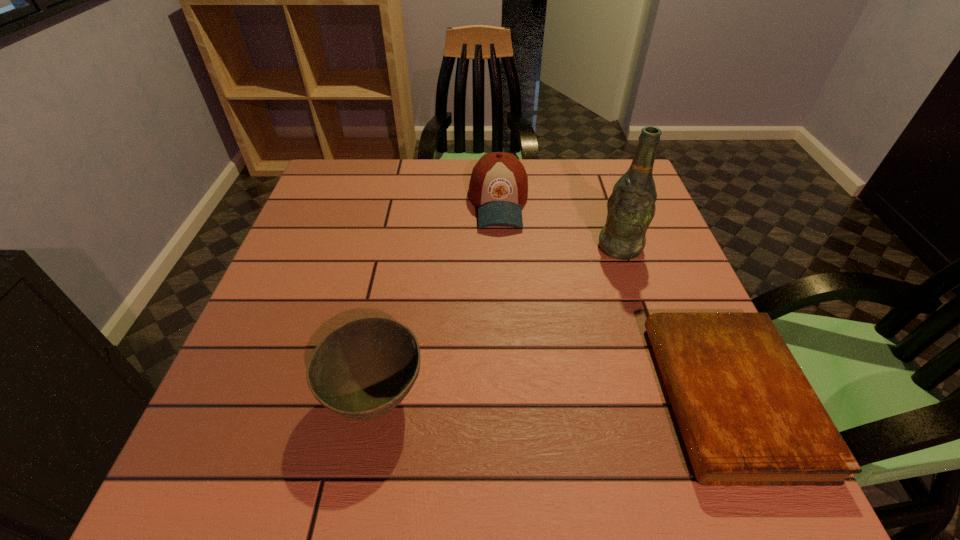
At what (x,y) coordinates should I click in order to perform the action: click on the leftmost object. Please return your answer as a coordinate pair (x, y). The width and height of the screenshot is (960, 540). Looking at the image, I should click on 363,369.

You are a GUI agent. You are given a task and a screenshot of the screen. Output one action in this format:
    pyautogui.click(x=<x>, y=<y>)
    Task: Click on the Bible
    
    Given the screenshot: What is the action you would take?
    pyautogui.click(x=748, y=416)

Locate an element on the screen. the tallest object is located at coordinates (631, 207).

I want to click on the third object from right to left, so click(x=498, y=185).

Locate an element on the screen. This screenshot has height=540, width=960. free space located 0.090m on the left of the bowl is located at coordinates (274, 397).

Identify the location of vacant space located on the spine side of the shortest object. (449, 397).

Image resolution: width=960 pixels, height=540 pixels. Find the location of `free space located on the spine side of the shortest object`. free space located on the spine side of the shortest object is located at coordinates (438, 397).

Image resolution: width=960 pixels, height=540 pixels. I want to click on vacant region located on the spine side of the shortest object, so click(x=471, y=397).

You are a GUI agent. You are given a task and a screenshot of the screen. Output one action in this format:
    pyautogui.click(x=<x>, y=<y>)
    Task: Click on the free spot located on the surface of the tallest object
    The height and width of the screenshot is (540, 960).
    Given the screenshot: What is the action you would take?
    pyautogui.click(x=598, y=276)

Where is `blank space located on the surface of the tallest object`? The height and width of the screenshot is (540, 960). blank space located on the surface of the tallest object is located at coordinates (553, 338).